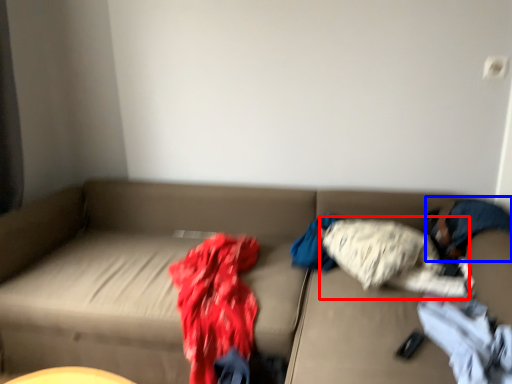
Question: Which of the following is the farthest to the observer, clothing (highlighted by a red box) or person (highlighted by a blue box)?

Choices:
 (A) clothing
 (B) person

Answer: (A)